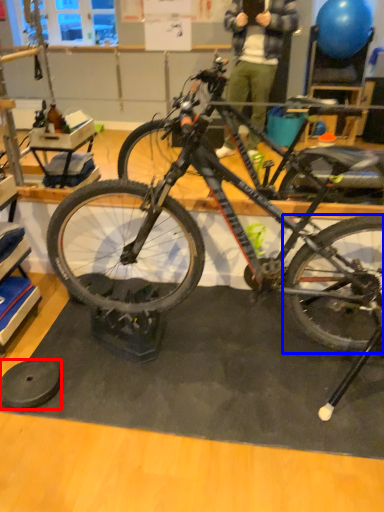
Question: Which of the following is the closest to the observer, wheel (highlighted by a red box) or bicycle wheel (highlighted by a blue box)?

Choices:
 (A) wheel
 (B) bicycle wheel

Answer: (B)